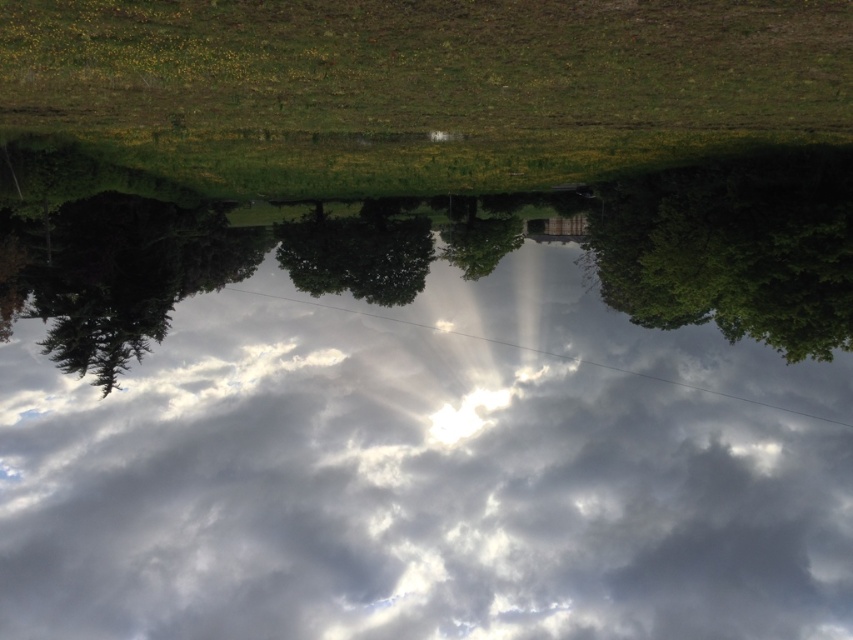
Question: Is white fluffy cloud at center in front of green leafy tree at center?

Choices:
 (A) yes
 (B) no

Answer: (A)

Question: Does white fluffy cloud at center appear under green leafy tree at center?

Choices:
 (A) no
 (B) yes

Answer: (B)

Question: Among these points, which one is farthest from the camera?

Choices:
 (A) (433, 268)
 (B) (368, 227)

Answer: (A)

Question: Does white fluffy cloud at center have a smaller size compared to green leafy tree at center?

Choices:
 (A) no
 (B) yes

Answer: (A)

Question: Which point appears closest to the camera in this image?

Choices:
 (A) (347, 244)
 (B) (364, 616)

Answer: (A)